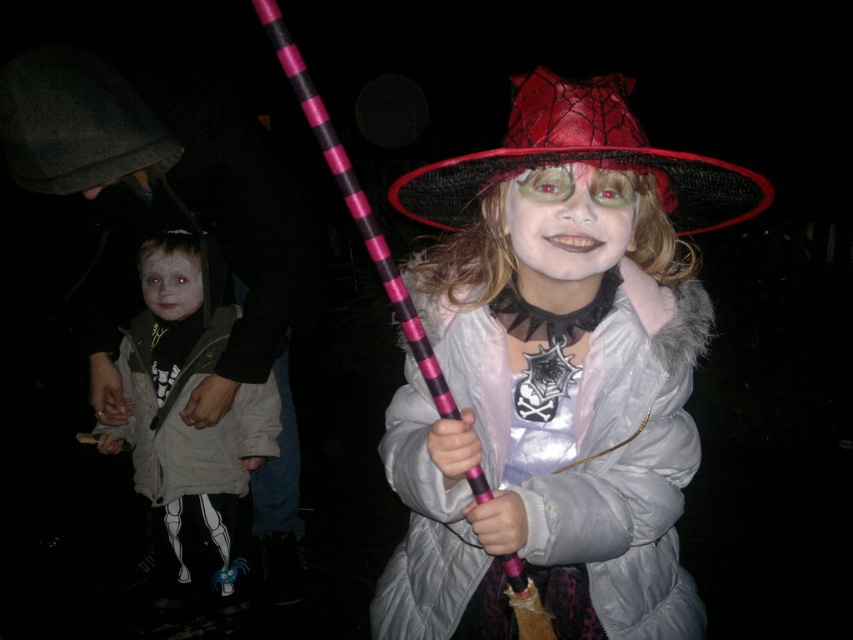
You are a costume designer preparing for a Halloween parade. You need to ensure that the matte pink wand at center and the red mesh witch hat at center are visible to the audience. Considering their sizes, which object should be placed higher to ensure visibility?

The matte pink wand at center is larger in size compared to the red mesh witch hat at center. To ensure visibility, the larger matte pink wand at center should be placed higher so that both objects can be seen clearly by the audience.

You are a photographer trying to capture a clear photo of the matte black face at center without the red mesh witch hat at center blocking it. What should you do?

The red mesh witch hat at center is in front of the matte black face at center, so you should move the camera angle to position the matte black face at center behind the red mesh witch hat at center or adjust their positions so that the matte black face at center is no longer obscured.